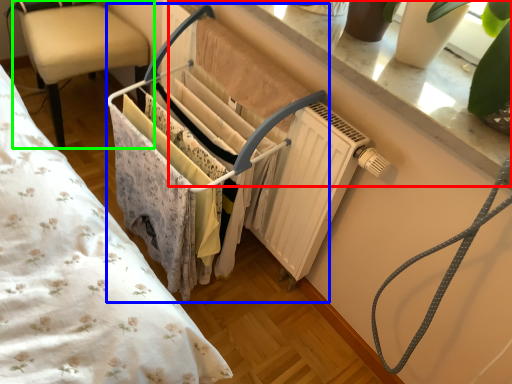
Question: Which object is the closest to the window sill (highlighted by a red box)? Choose among these: closet (highlighted by a blue box) or chair (highlighted by a green box).

Choices:
 (A) closet
 (B) chair

Answer: (A)